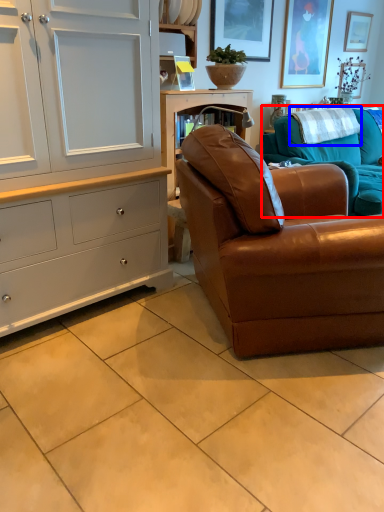
Question: Among these objects, which one is farthest to the camera, studio couch (highlighted by a red box) or blanket (highlighted by a blue box)?

Choices:
 (A) studio couch
 (B) blanket

Answer: (B)